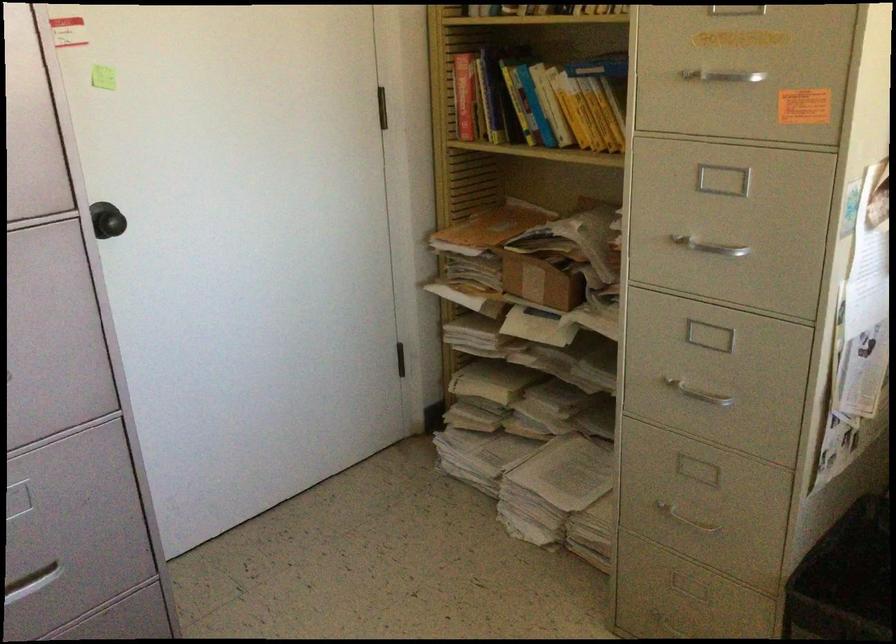
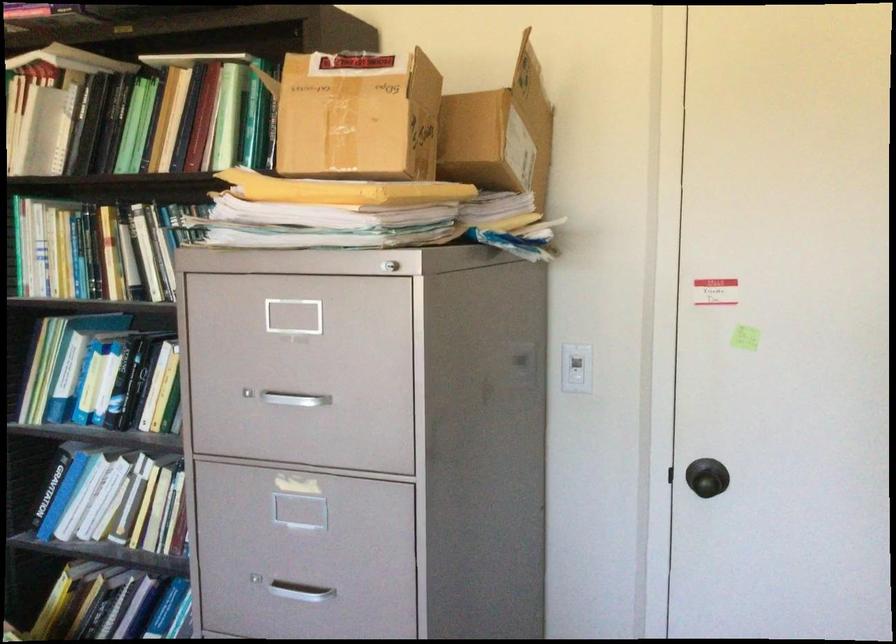
In the second image, find the point that corresponds to [108,223] in the first image.

(707, 482)